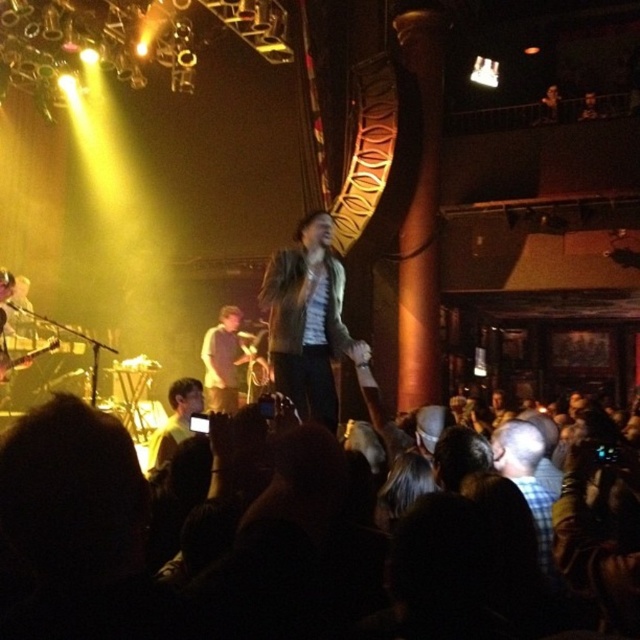
Can you confirm if leather jacket at center is positioned to the left of dark brown leather jacket at lower left?

In fact, leather jacket at center is to the right of dark brown leather jacket at lower left.

Who is more distant from viewer, (x=276, y=312) or (x=170, y=440)?

Positioned behind is point (x=170, y=440).

The height and width of the screenshot is (640, 640). Find the location of `leather jacket at center`. leather jacket at center is located at coordinates (307, 320).